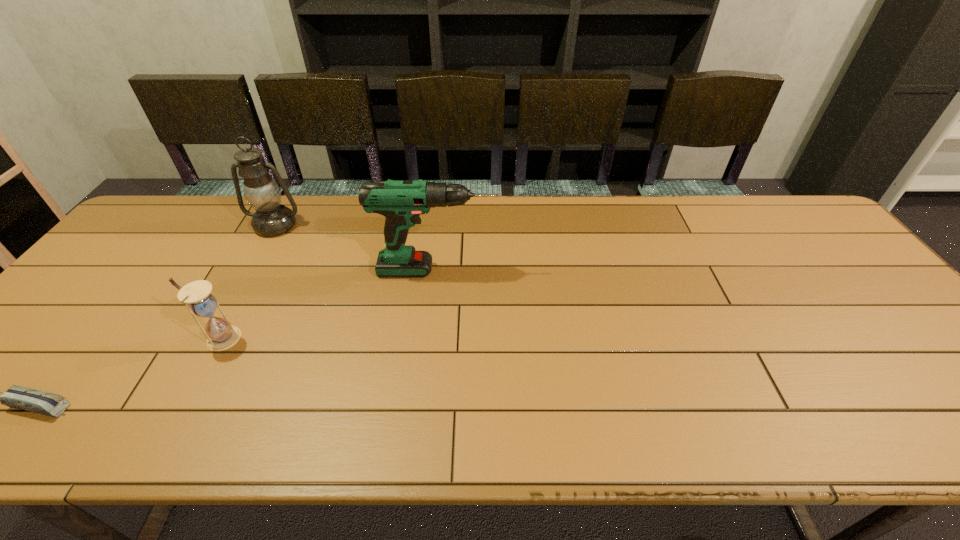
The image size is (960, 540). In the image, there is a desktop. Find the location of `free region at the near edge`. free region at the near edge is located at coordinates (312, 408).

Find the location of a particular element. Image resolution: width=960 pixels, height=540 pixels. vacant space at the right edge of the desktop is located at coordinates (949, 385).

Locate an element on the screen. free space at the far right corner is located at coordinates (812, 237).

This screenshot has width=960, height=540. Find the location of `free space between the oil lamp and the third tallest object`. free space between the oil lamp and the third tallest object is located at coordinates (249, 282).

You are a GUI agent. You are given a task and a screenshot of the screen. Output one action in this format:
    pyautogui.click(x=<x>, y=<y>)
    Task: Click on the vacant space that's between the third farthest object and the rightmost object
    
    Given the screenshot: What is the action you would take?
    pyautogui.click(x=328, y=304)

This screenshot has height=540, width=960. I want to click on free space between the third nearest object and the third tallest object, so click(x=328, y=304).

At what (x,y) coordinates should I click in order to perform the action: click on free spot between the drill and the hourglass. Please return your answer as a coordinate pair (x, y). Image resolution: width=960 pixels, height=540 pixels. Looking at the image, I should click on (328, 304).

This screenshot has height=540, width=960. In order to click on vacant space in between the second farthest object and the third tallest object in this screenshot , I will do `click(328, 304)`.

Identify the location of vacant space in between the farthest object and the rightmost object. Image resolution: width=960 pixels, height=540 pixels. (356, 248).

Locate an element on the screen. This screenshot has height=540, width=960. vacant area that lies between the rightmost object and the oil lamp is located at coordinates (356, 248).